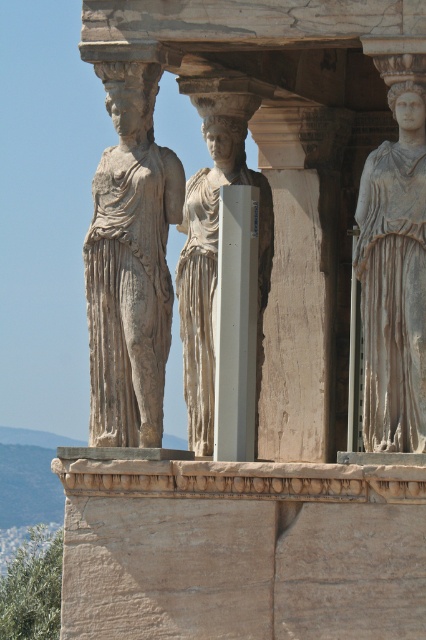
Looking at this image, is gray stone statue at center shorter than white smooth pillar at center?

No.

Can you confirm if gray stone statue at center is smaller than white smooth pillar at center?

No.

Which is behind, point (411, 412) or point (253, 412)?

Point (253, 412)

Where is `gray stone statue at center`? Image resolution: width=426 pixels, height=640 pixels. gray stone statue at center is located at coordinates (394, 280).

Locate an element on the screen. gray stone statue at left is located at coordinates (129, 262).

Does gray stone statue at left appear on the left side of white marble statue at center?

Indeed, gray stone statue at left is positioned on the left side of white marble statue at center.

Does point (150, 305) lie in front of point (198, 236)?

That is True.

Locate an element on the screen. This screenshot has width=426, height=640. gray stone statue at left is located at coordinates (129, 262).

Which of these two, gray stone statue at left or gray stone statue at center, stands taller?

Standing taller between the two is gray stone statue at left.

Does gray stone statue at left have a smaller size compared to gray stone statue at center?

No, gray stone statue at left is not smaller than gray stone statue at center.

In order to click on gray stone statue at left in this screenshot , I will do `click(129, 262)`.